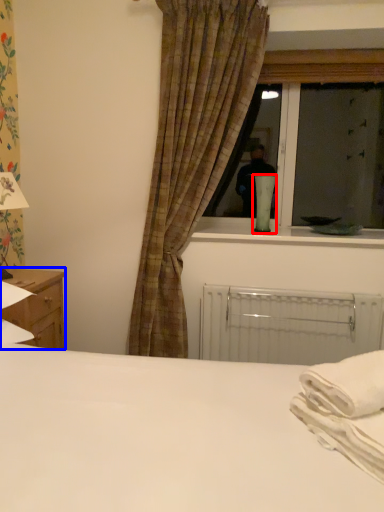
Question: Which object appears closest to the camera in this image, table lamp (highlighted by a red box) or nightstand (highlighted by a blue box)?

Choices:
 (A) table lamp
 (B) nightstand

Answer: (B)